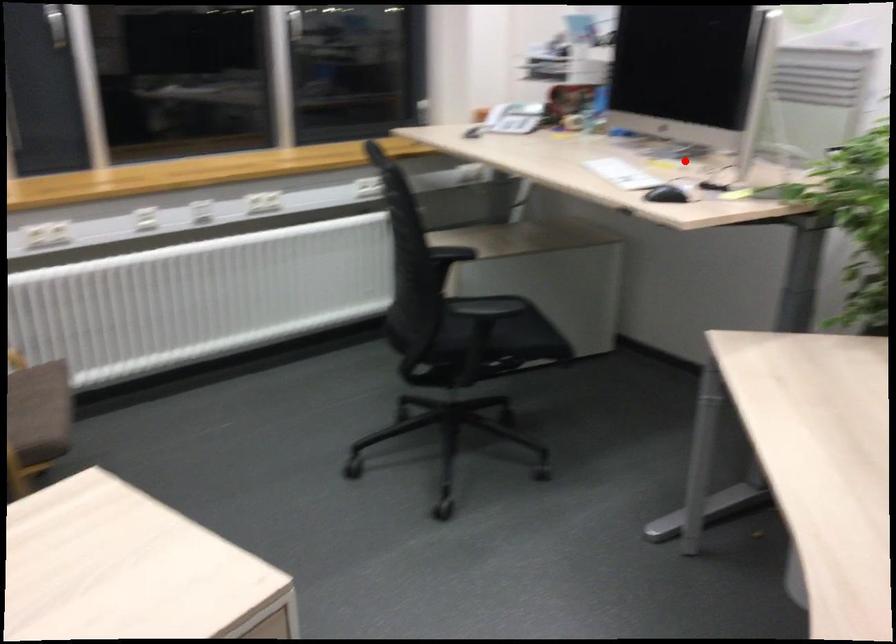
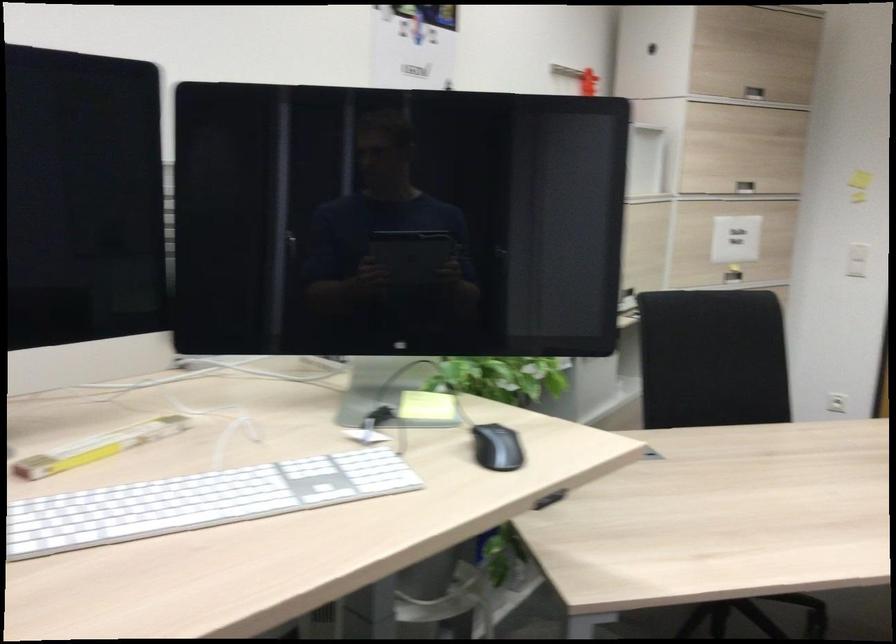
The point at the highlighted location is marked in the first image. Where is the corresponding point in the second image?

(98, 447)